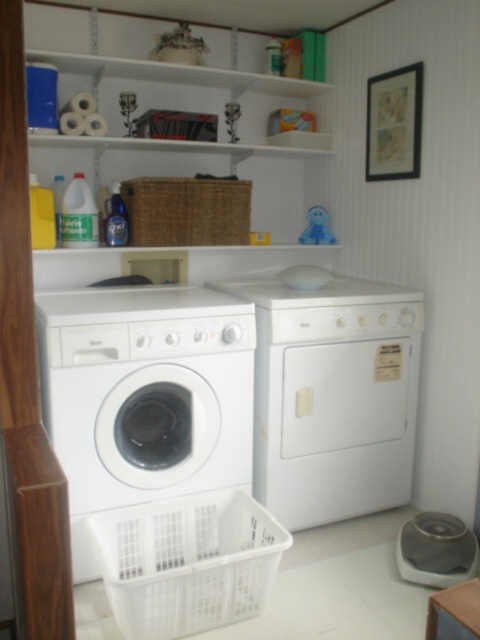
Question: Which point appears farthest from the camera in this image?

Choices:
 (A) (84, 67)
 (B) (153, 228)
 (C) (292, 512)

Answer: (B)

Question: Can you confirm if white matte washing machine at center is bigger than white matte dryer at center?

Choices:
 (A) no
 (B) yes

Answer: (B)

Question: Which object is closer to the camera taking this photo?

Choices:
 (A) white matte shelves at upper center
 (B) white matte washing machine at center
 (C) white matte dryer at center
 (D) woven brown basket at upper center

Answer: (B)

Question: Which of the following is the farthest from the observer?

Choices:
 (A) woven brown basket at upper center
 (B) white matte dryer at center
 (C) white matte shelves at upper center

Answer: (A)

Question: Where is woven brown basket at upper center located in relation to white matte shelves at upper center in the image?

Choices:
 (A) below
 (B) above

Answer: (A)

Question: Can you confirm if woven brown basket at upper center is bigger than white matte shelves at upper center?

Choices:
 (A) yes
 (B) no

Answer: (B)